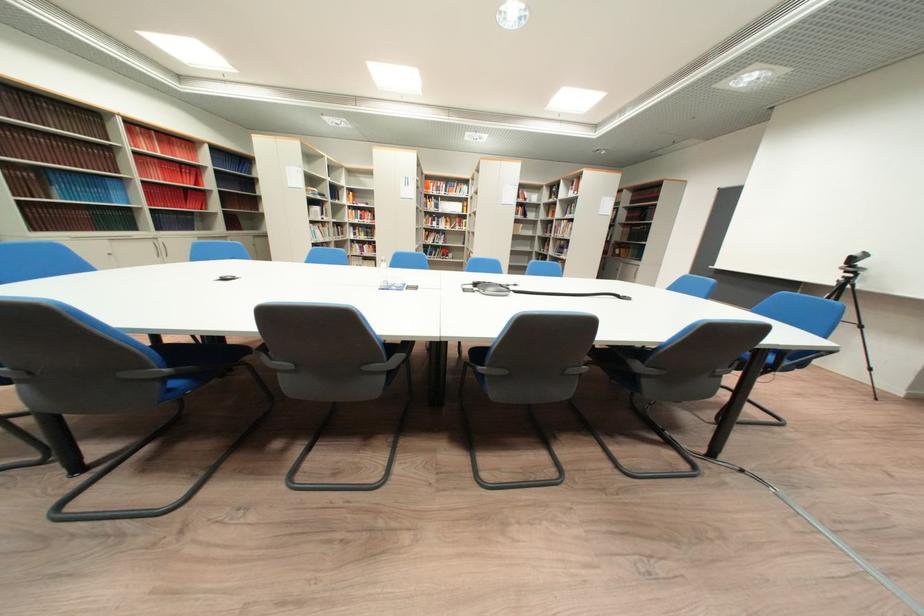
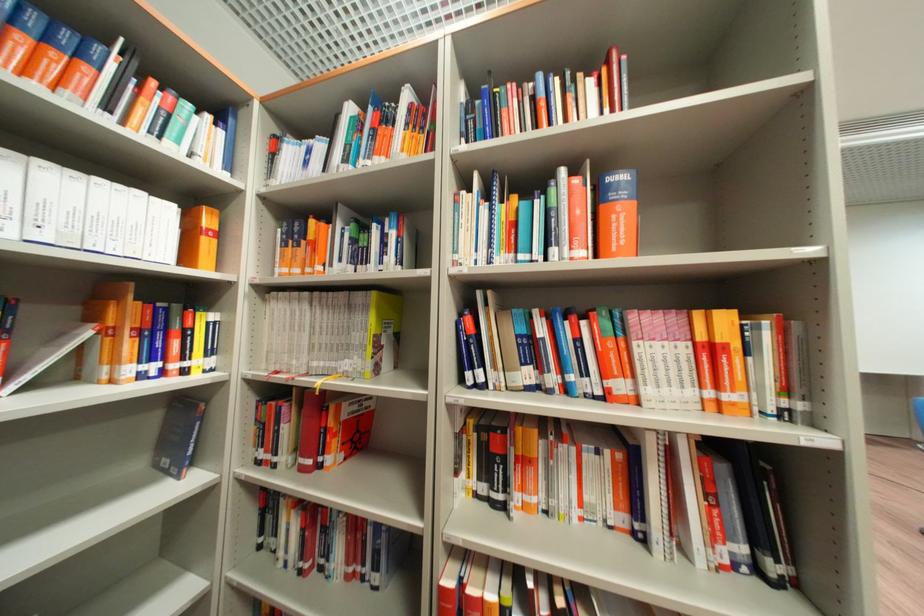
Find the pixel in the second image that matches (473,213) in the first image.

(198, 260)